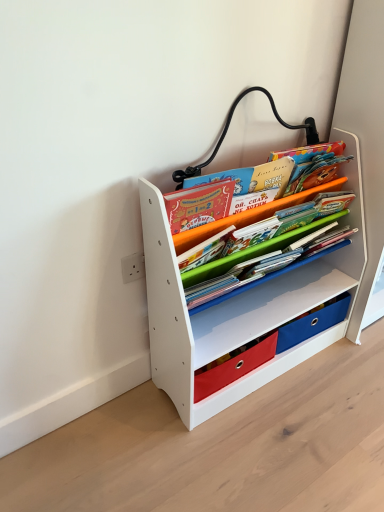
Where is `vacant space in front of white matte bookshelf at center`? vacant space in front of white matte bookshelf at center is located at coordinates (256, 446).